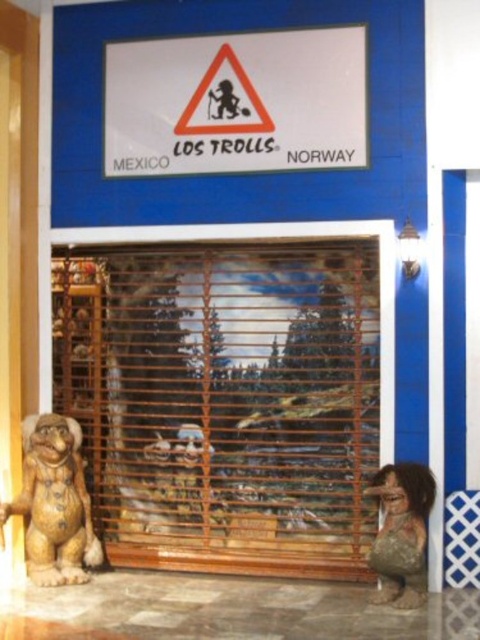
Question: Is white paper sign at upper center positioned in front of matte brown statue at lower right?

Choices:
 (A) no
 (B) yes

Answer: (A)

Question: Estimate the real-world distances between objects in this image. Which object is farther from the white paper sign at upper center?

Choices:
 (A) brown wooden figurine at lower left
 (B) matte brown statue at lower right

Answer: (B)

Question: Which point is closer to the camera?

Choices:
 (A) white paper sign at upper center
 (B) matte brown statue at lower right

Answer: (B)

Question: Is white paper sign at upper center bigger than brown wooden figurine at lower left?

Choices:
 (A) no
 (B) yes

Answer: (B)

Question: Is white paper sign at upper center positioned at the back of matte brown statue at lower right?

Choices:
 (A) no
 (B) yes

Answer: (B)

Question: Which point is closer to the camera taking this photo?

Choices:
 (A) (36, 429)
 (B) (399, 579)

Answer: (B)